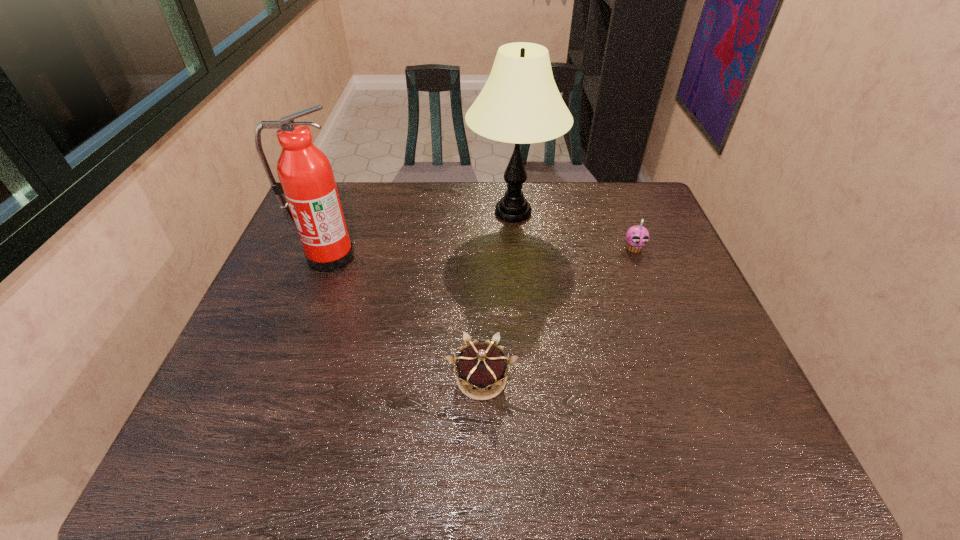
What are the coordinates of `blank region between the leftmost object and the lamp` in the screenshot? It's located at (420, 234).

Identify the location of vacant region between the crown and the leftmost object. (405, 318).

The height and width of the screenshot is (540, 960). In order to click on empty space between the crown and the fire extinguisher in this screenshot , I will do `click(405, 318)`.

Where is `vacant area between the leftmost object and the cupcake`? vacant area between the leftmost object and the cupcake is located at coordinates (481, 252).

Where is `free space between the lamp and the leftmost object`? The height and width of the screenshot is (540, 960). free space between the lamp and the leftmost object is located at coordinates pos(420,234).

Locate an element on the screen. The width and height of the screenshot is (960, 540). free space that is in between the fire extinguisher and the lamp is located at coordinates (420, 234).

The image size is (960, 540). What are the coordinates of `free point between the lamp and the crown` in the screenshot? It's located at (497, 296).

What are the coordinates of `object that ranks as the second closest to the lamp` in the screenshot? It's located at (313, 205).

Choose which object is the nearest neighbor to the lamp. Please provide its 2D coordinates. Your answer should be formatted as a tuple, i.e. [(x, y)], where the tuple contains the x and y coordinates of a point satisfying the conditions above.

[(637, 237)]

Locate an element on the screen. free location that satisfies the following two spatial constraints: 1. on the label side of the nearest object; 2. on the left side of the leftmost object is located at coordinates (282, 379).